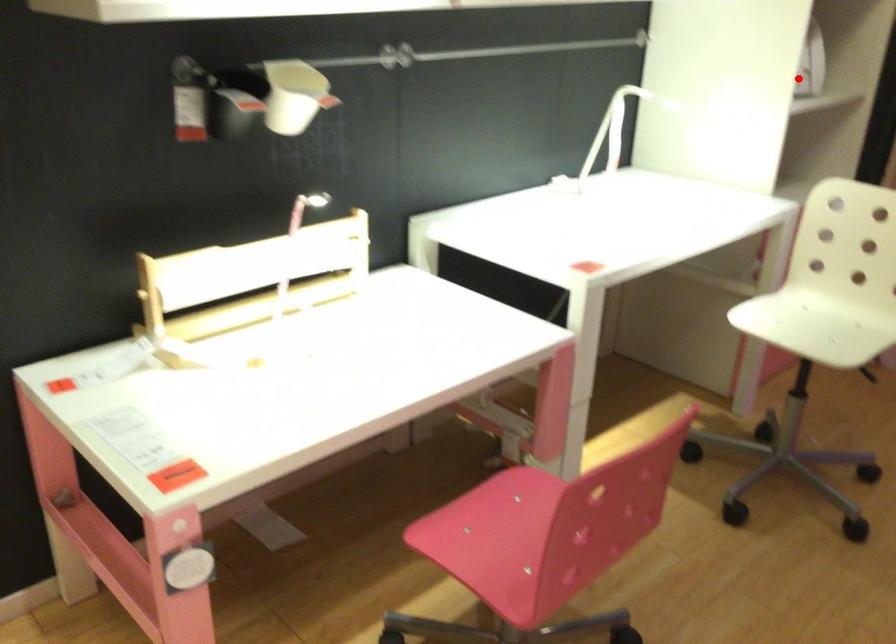
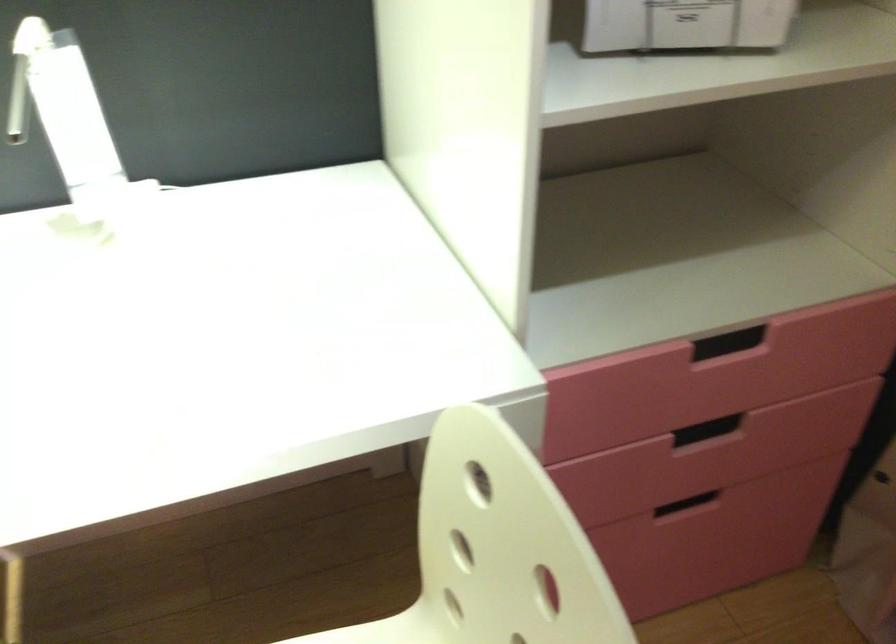
Find the pixel in the second image that matches the highlighted location in the first image.

(685, 24)